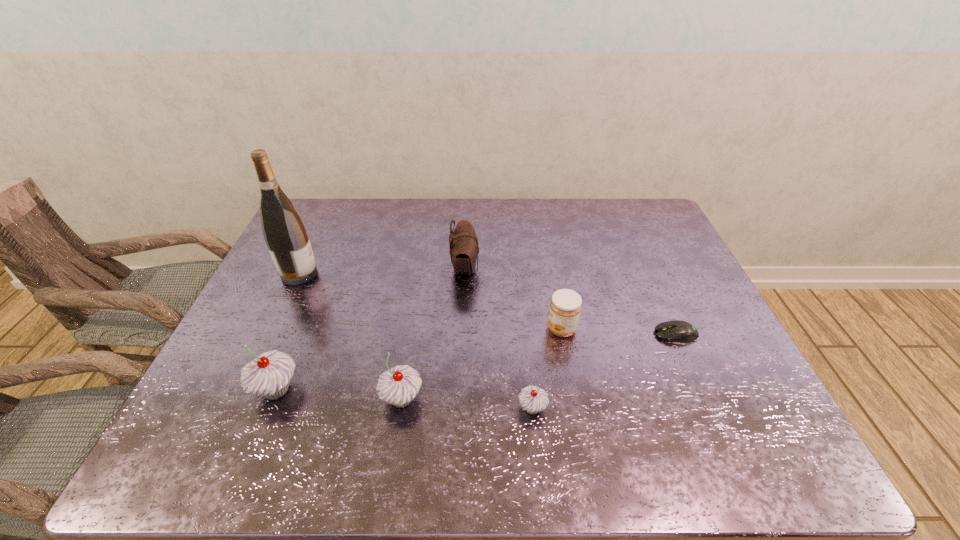
Locate an element on the screen. The image size is (960, 540). vacant space located 0.070m on the right of the leftmost cupcake is located at coordinates (330, 390).

What are the coordinates of `free space located 0.320m on the right of the second cupcake from right to left` in the screenshot? It's located at (564, 399).

This screenshot has height=540, width=960. In order to click on free space located 0.160m on the left of the rightmost cupcake in this screenshot , I will do coord(445,408).

Locate an element on the screen. The width and height of the screenshot is (960, 540). blank space located 0.300m with the flap open on the pouch is located at coordinates (x=578, y=268).

I want to click on vacant space situated 0.380m on the front label of the jam, so click(402, 329).

Image resolution: width=960 pixels, height=540 pixels. What are the coordinates of `vacant space located 0.050m on the front label of the jam` in the screenshot? It's located at (528, 329).

Find the location of a particular element. Image resolution: width=960 pixels, height=540 pixels. vacant position located on the front label of the jam is located at coordinates (459, 329).

The image size is (960, 540). I want to click on vacant area located on the label of the tallest object, so click(x=424, y=274).

The width and height of the screenshot is (960, 540). What are the coordinates of `vacant area situated 0.190m on the wheel side of the shortest object` in the screenshot? It's located at (581, 334).

I want to click on free space located on the wheel side of the shortest object, so click(x=608, y=334).